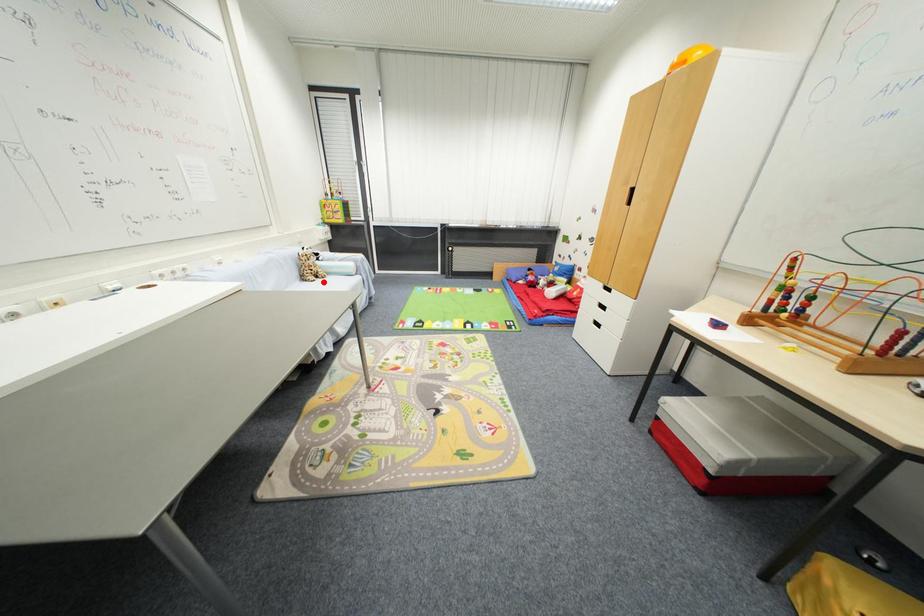
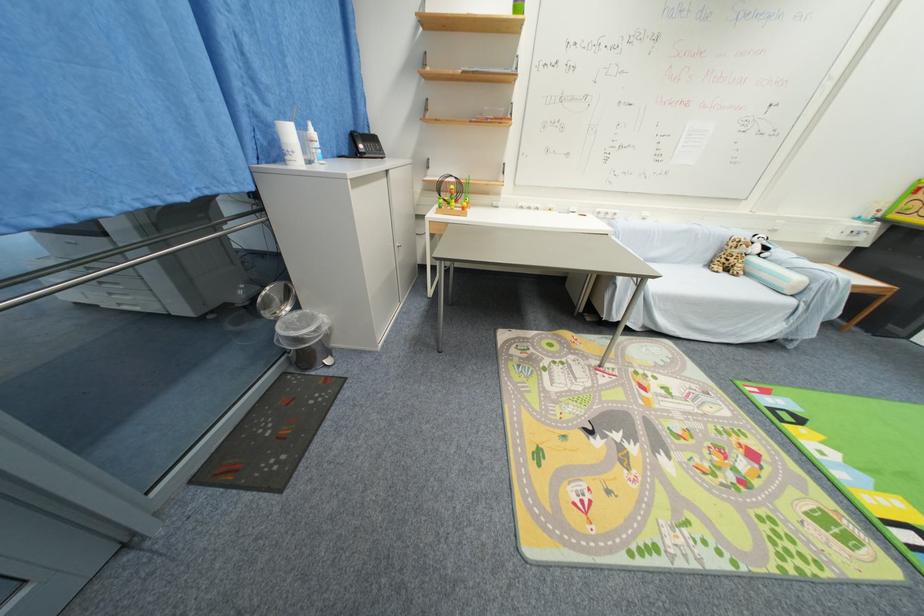
Where in the second image is the point corresponding to the highlighted location from the first image?

(730, 276)